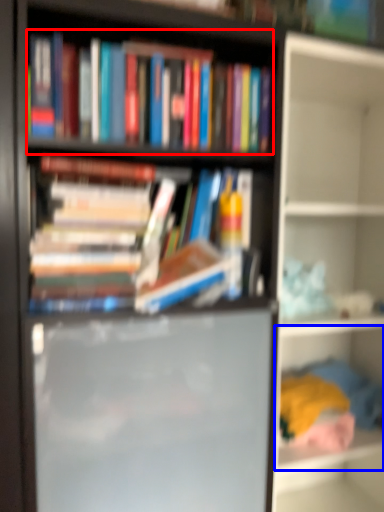
Question: Which object appears farthest to the camera in this image, book (highlighted by a red box) or shelf (highlighted by a blue box)?

Choices:
 (A) book
 (B) shelf

Answer: (B)